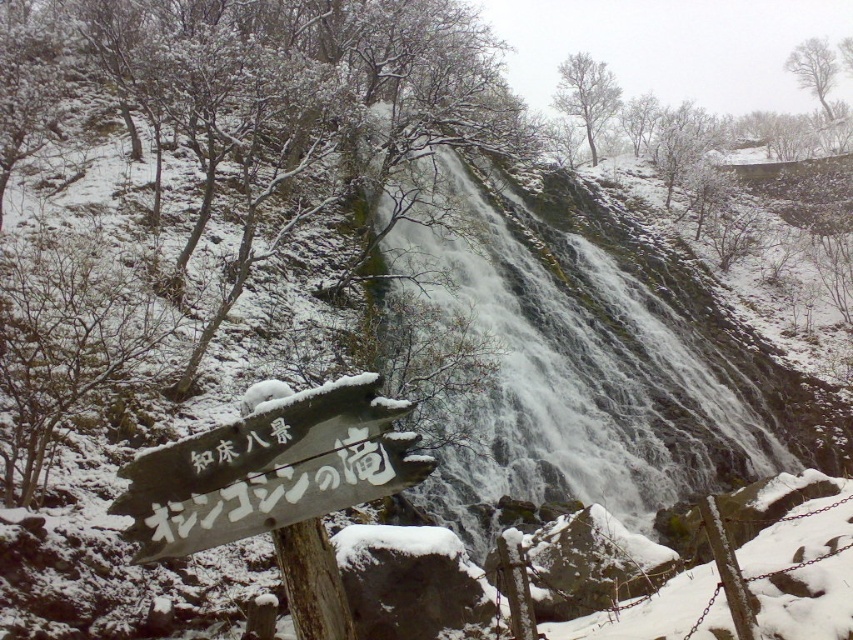
Looking at this image, you are a hiker trying to read the white wooden sign at lower left while standing in front of the white frothy water at center. Can you see the sign clearly from your current position?

The white wooden sign at lower left is behind the white frothy water at center, so it might be obscured by the waterfall and difficult to read clearly from your current position.

You are standing at the viewpoint of the image and want to reach the point marked at coordinates point (668, 390). If your walking speed is 3 feet per second, how many seconds will it take you to reach that point?

The distance between you and point (668, 390) is 88.46 feet. At a speed of 3 feet per second, it will take approximately 29.49 seconds to reach the point.

You are a hiker trying to locate the waterfall in the winter landscape. You see the white wooden sign at lower left and the white frothy water at center. According to the scene, which object is positioned to the right of the other?

The white frothy water at center is positioned on the right side of the white wooden sign at lower left.